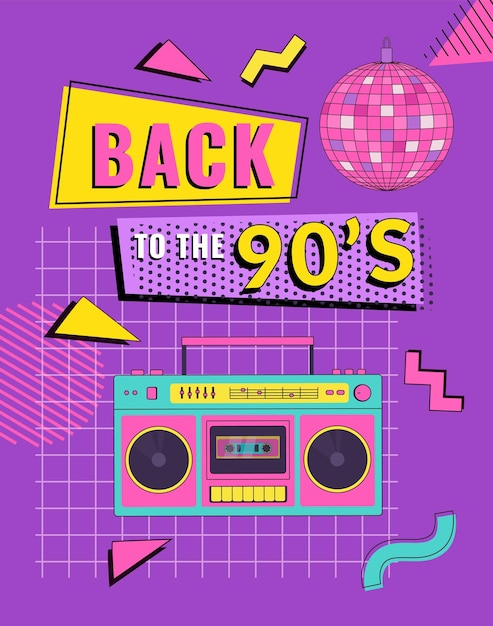
Identify the location of speakers. This screenshot has width=493, height=626. (173, 470), (318, 449).